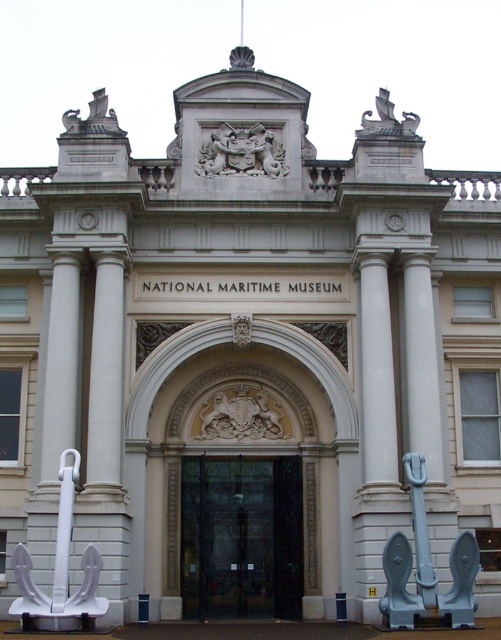
Question: Estimate the real-world distances between objects in this image. Which object is closer to the black glass door at center?

Choices:
 (A) carved stone coat of arms at center
 (B) light blue metallic anchor at right

Answer: (B)

Question: Which point is closer to the camera?

Choices:
 (A) (91, 124)
 (B) (263, 125)
 (C) (20, 611)

Answer: (C)

Question: Is black glass door at center further to the viewer compared to white matte anchor at lower left?

Choices:
 (A) yes
 (B) no

Answer: (A)

Question: Can you confirm if light blue metallic anchor at right is positioned below carved stone coat of arms at center?

Choices:
 (A) yes
 (B) no

Answer: (A)

Question: Which of these objects is positioned closest to the white matte anchor at lower left?

Choices:
 (A) bronze ship at upper center
 (B) black glass door at center
 (C) light blue metallic anchor at right

Answer: (B)

Question: Is polished stone coat of arms at center to the right of bronze ship at upper center from the viewer's perspective?

Choices:
 (A) yes
 (B) no

Answer: (A)